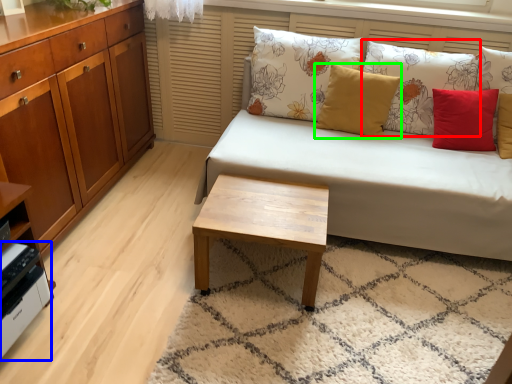
Question: Which object is positioned closest to pillow (highlighted by a red box)? Select from appliance (highlighted by a blue box) and pillow (highlighted by a green box).

Choices:
 (A) appliance
 (B) pillow

Answer: (B)